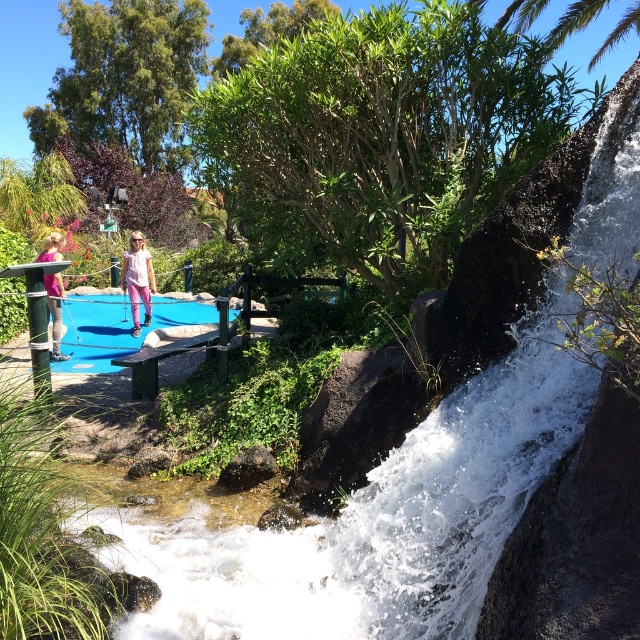
You are standing at the edge of the stream and want to reach the white frothy water at upper right. Given that the stream is 1.5 meters deep, can you safely walk across it?

The stream is only 1.5 meters deep, so yes, you can safely walk across it to reach the white frothy water at upper right.

You are standing at the base of the waterfall and want to reach the wooden bench near the waterfall. The point marked at coordinates (458, 483) is part of the white frothy water at upper right. Which direction should you move to get to the bench?

The point marked at coordinates (458, 483) corresponds to the white frothy water at upper right, which is located above the bench. To reach the bench, you should move downward from the waterfall towards the lower area where the bench is positioned.